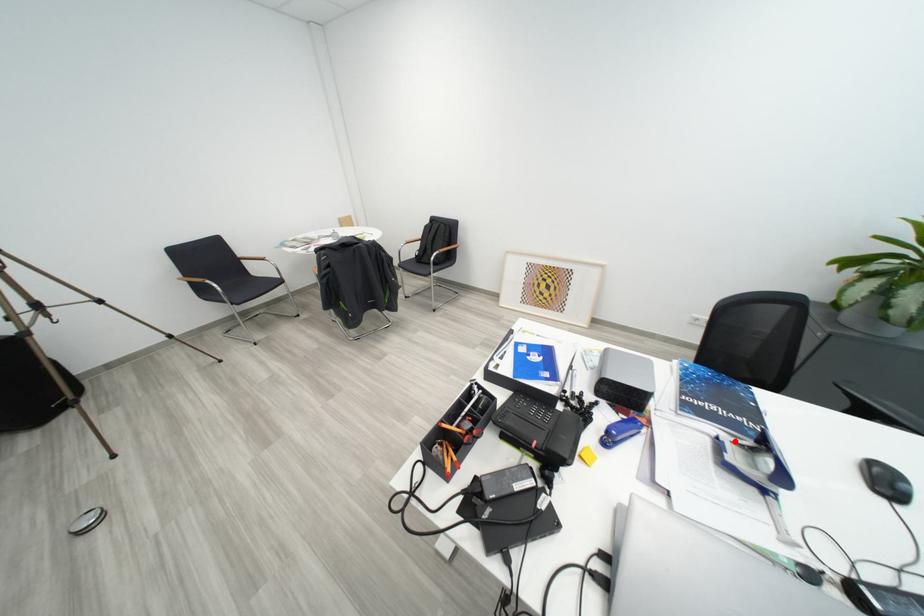
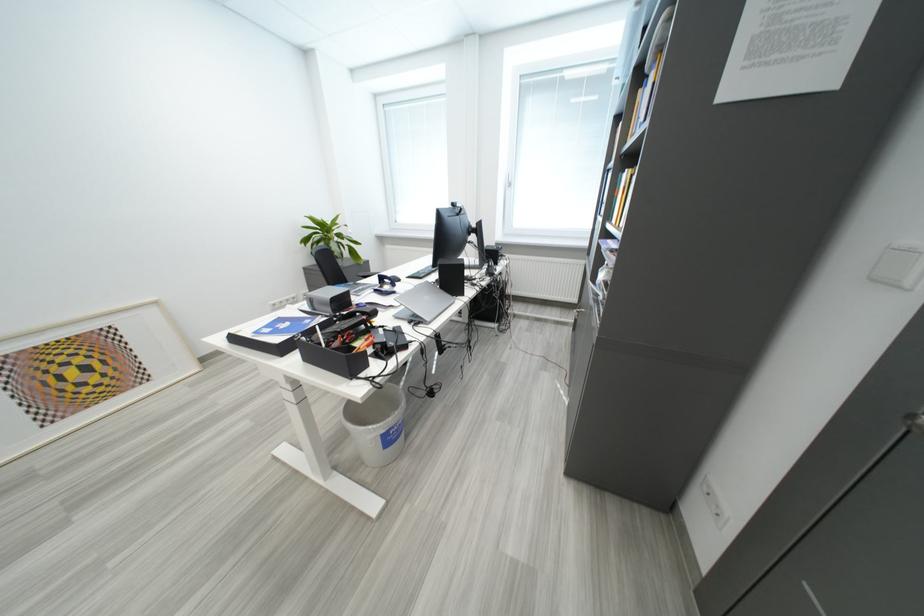
The point at the highlighted location is marked in the first image. Where is the corresponding point in the second image?

(384, 291)